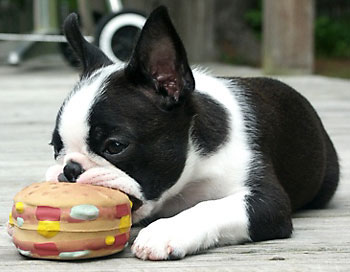
The width and height of the screenshot is (350, 272). I want to click on light grey carpet, so click(x=314, y=259), click(x=36, y=119), click(x=325, y=86).